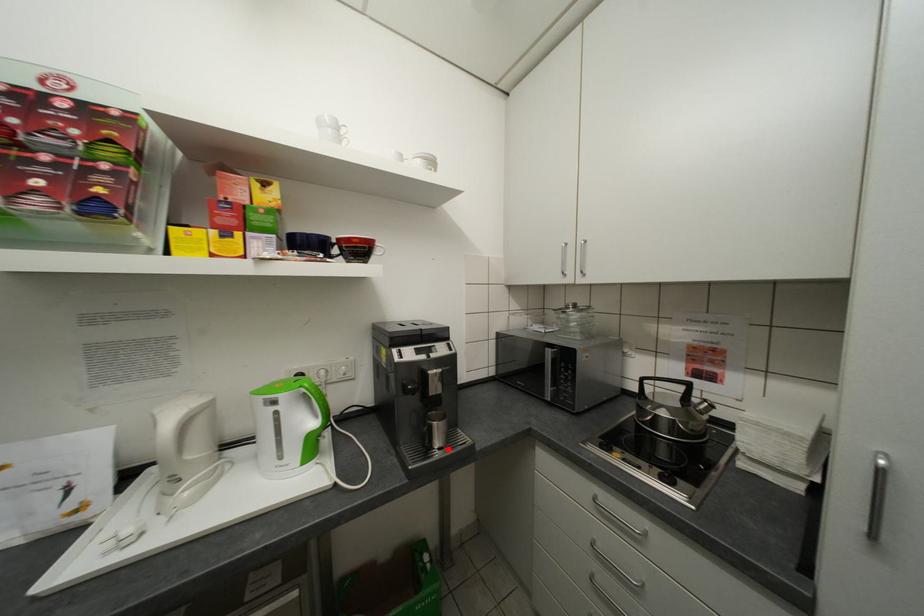
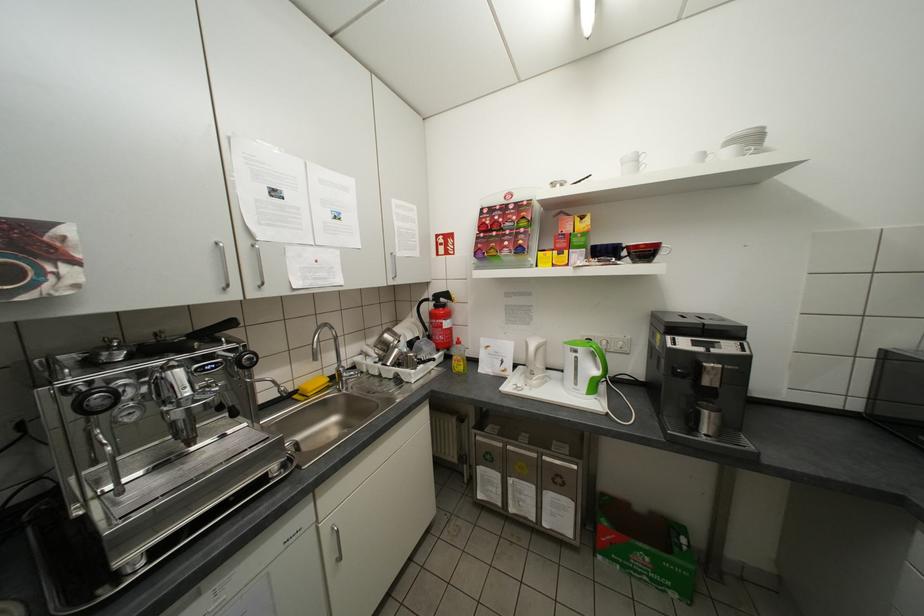
The point at the highlighted location is marked in the first image. Where is the corresponding point in the second image?

(714, 436)